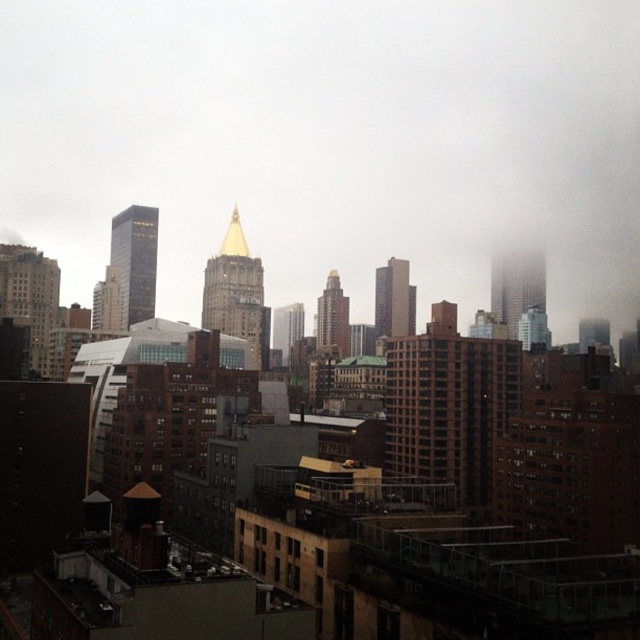
You are an architect analyzing the cityscape. You observe the transparent fog at center and the smooth gray skyscraper at center. Which object is located higher in the image?

The transparent fog at center is positioned over the smooth gray skyscraper at center, so it is higher in the image.

You are an urban planner assessing the city layout. You notice the matte glass skyscraper at left and the gold polished spire at center. Which structure is located to the east if the city streets are aligned north to south?

The matte glass skyscraper at left is positioned on the left side of gold polished spire at center. Since the streets are aligned north to south, the left side would correspond to the east direction. Therefore, the matte glass skyscraper at left is located to the east of the gold polished spire at center.

You are a drone operator trying to capture a clear aerial shot of the smooth gray skyscraper at center. However, there is transparent fog at center in the way. Based on the scene description, can you determine if the skyscraper is visible through the fog?

The smooth gray skyscraper at center is behind transparent fog at center, so it may be partially visible but obscured by the haze, making it difficult to capture a clear shot.